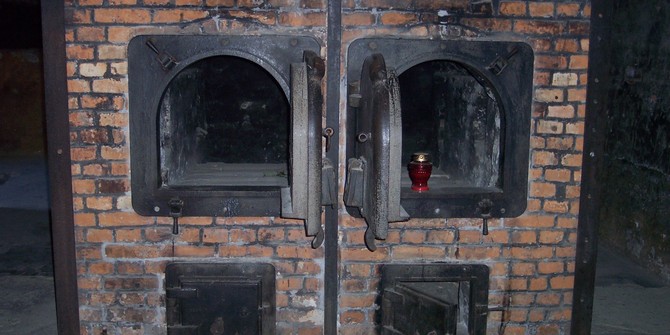
Locate an element on the screen. This screenshot has width=670, height=335. jar is located at coordinates (421, 172).